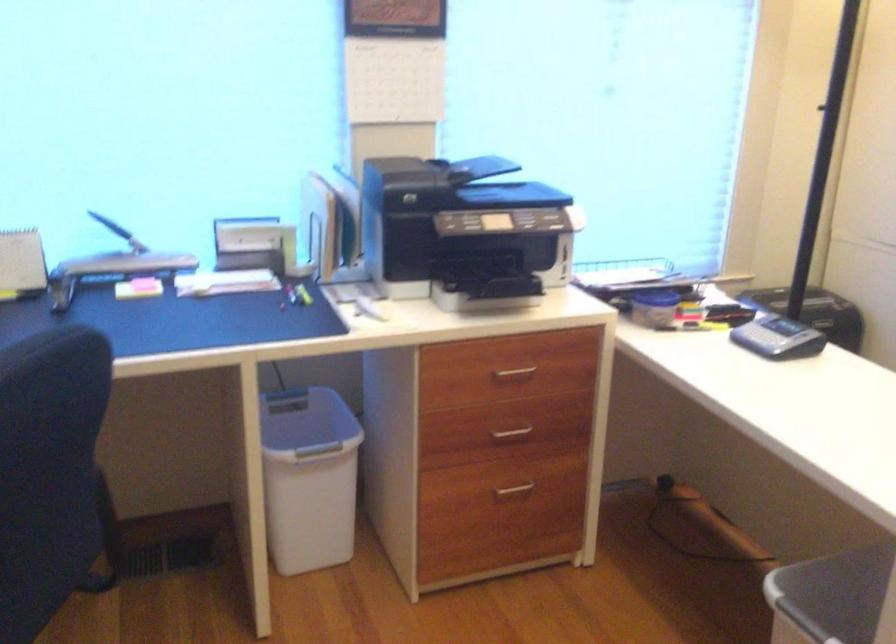
Where would you pull the gray monitor arm? Please return your answer as a coordinate pair (x, y).

(48, 471)